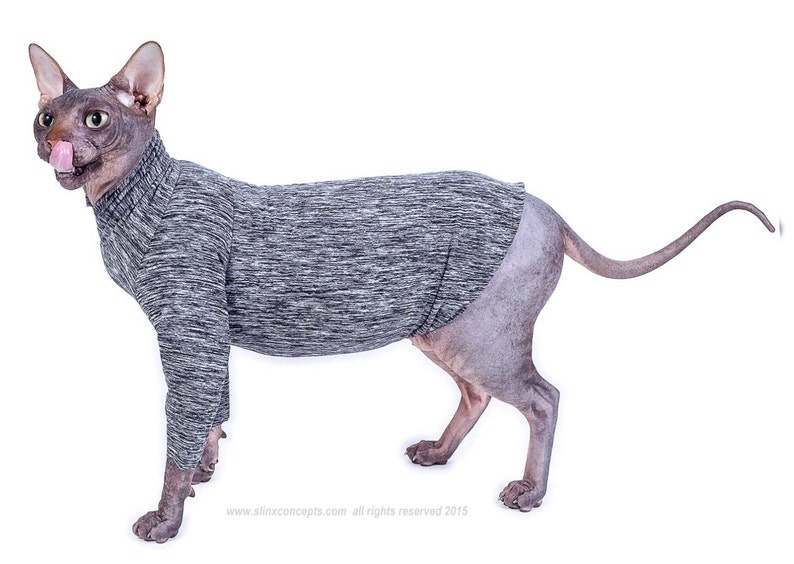
Locate an element on the screen. The width and height of the screenshot is (794, 564). chest is located at coordinates (120, 265).